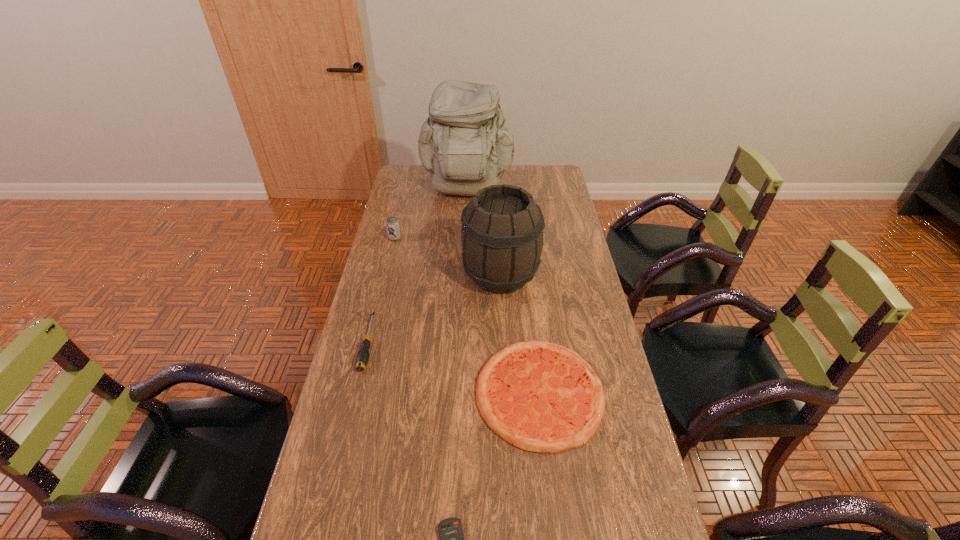
Identify the location of vacant region located on the right of the third tallest object. The height and width of the screenshot is (540, 960). (482, 238).

Image resolution: width=960 pixels, height=540 pixels. In order to click on free spot located 0.220m on the right of the screwdriver in this screenshot , I will do (x=444, y=343).

Image resolution: width=960 pixels, height=540 pixels. I want to click on vacant region located on the back of the pizza, so click(524, 262).

Identify the location of object located in the far edge section of the desktop. The width and height of the screenshot is (960, 540). (466, 144).

You are a GUI agent. You are given a task and a screenshot of the screen. Output one action in this format:
    pyautogui.click(x=<x>, y=<y>)
    Task: Click on the backpack positioned at the left edge
    The width and height of the screenshot is (960, 540).
    Given the screenshot: What is the action you would take?
    pyautogui.click(x=466, y=144)

You are a GUI agent. You are given a task and a screenshot of the screen. Output one action in this format:
    pyautogui.click(x=<x>, y=<y>)
    Task: Click on the beer can that is at the left edge
    The image size is (960, 540).
    Given the screenshot: What is the action you would take?
    pyautogui.click(x=392, y=224)

The height and width of the screenshot is (540, 960). I want to click on screwdriver situated at the left edge, so click(362, 358).

I want to click on object at the right edge, so click(538, 396).

This screenshot has height=540, width=960. What are the coordinates of `object that is at the far left corner` in the screenshot? It's located at (466, 144).

At what (x,y) coordinates should I click in order to perform the action: click on vacant space at the far edge. Please return your answer as a coordinate pair (x, y). Image resolution: width=960 pixels, height=540 pixels. Looking at the image, I should click on (434, 190).